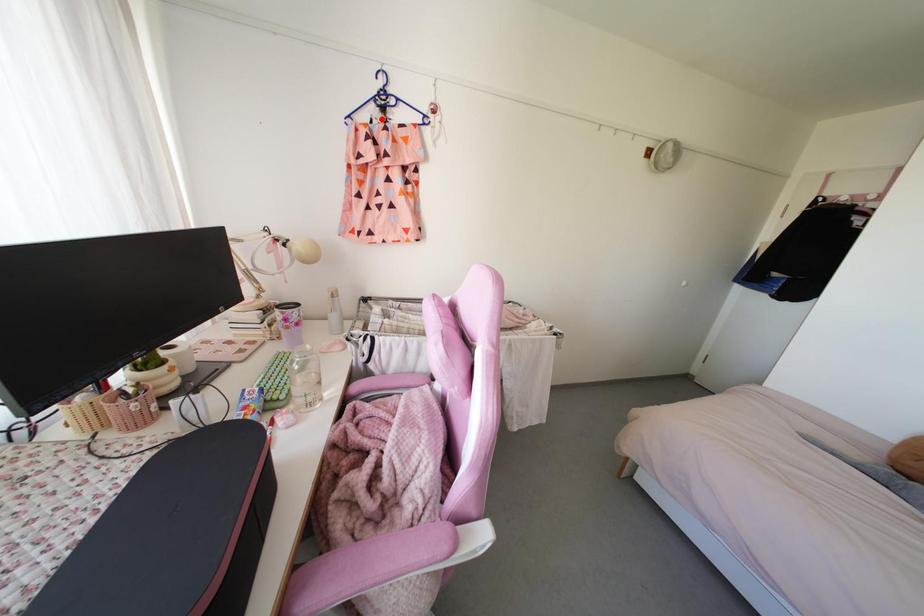
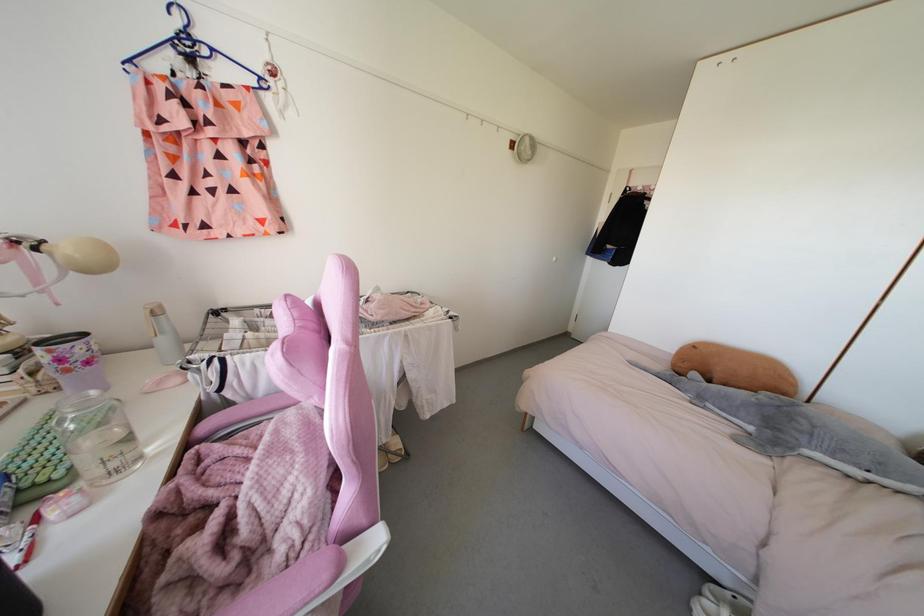
The point at the highlighted location is marked in the first image. Where is the corresponding point in the second image?

(191, 73)